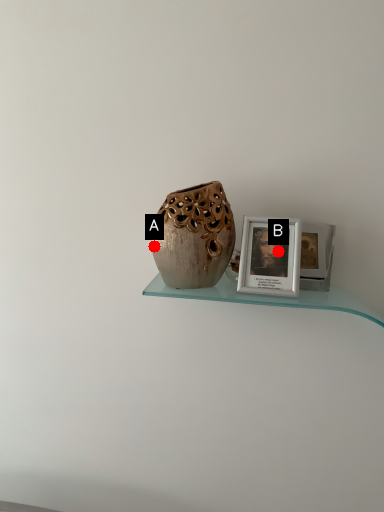
Question: Two points are circled on the image, labeled by A and B beside each circle. Which of the following is the closest to the observer?

Choices:
 (A) A is closer
 (B) B is closer

Answer: (A)